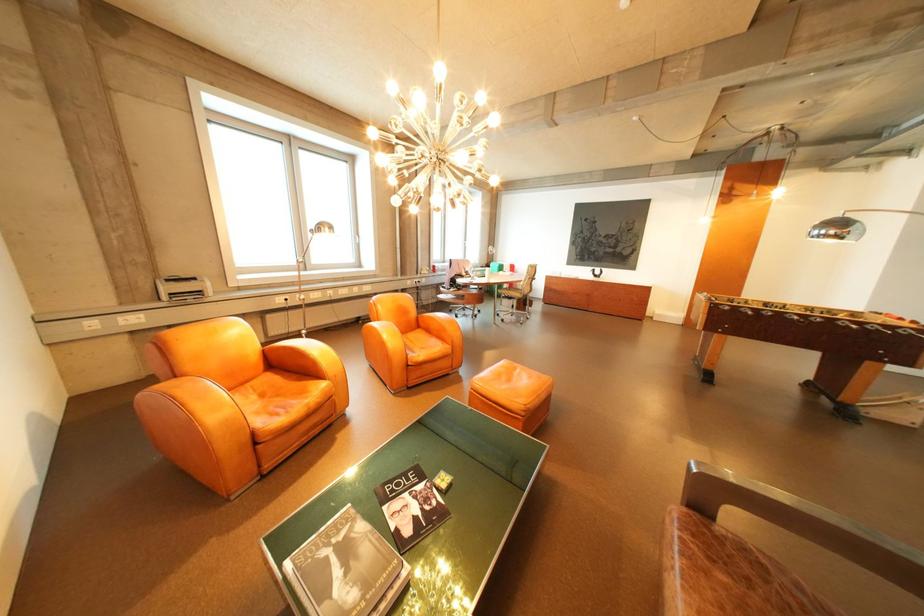
Find where to open the white cover book. Please return your answer as a coordinate pair (x, y).

(346, 569)